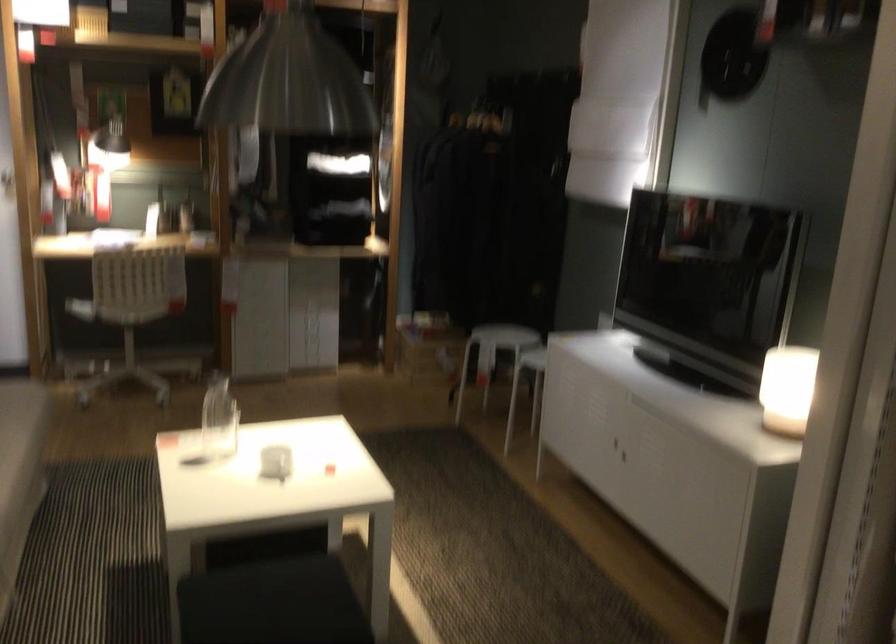
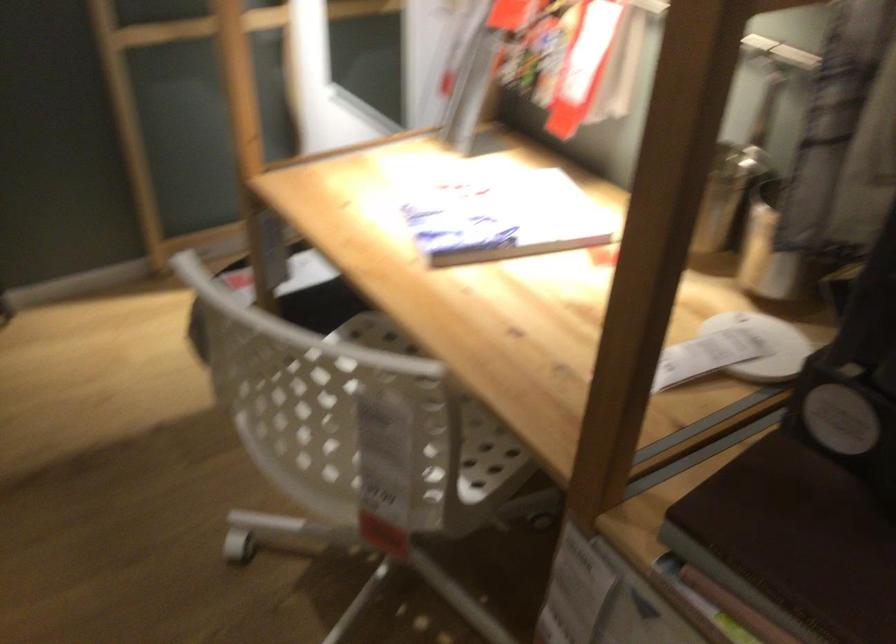
In the second image, find the point that corresponds to pixel 263 230 in the first image.

(793, 542)